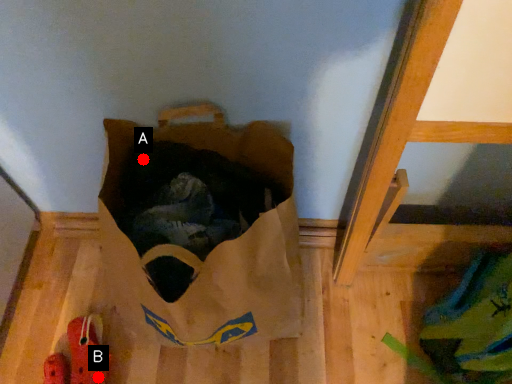
Question: Two points are circled on the image, labeled by A and B beside each circle. Which point appears farthest from the camera in this image?

Choices:
 (A) A is further
 (B) B is further

Answer: (B)